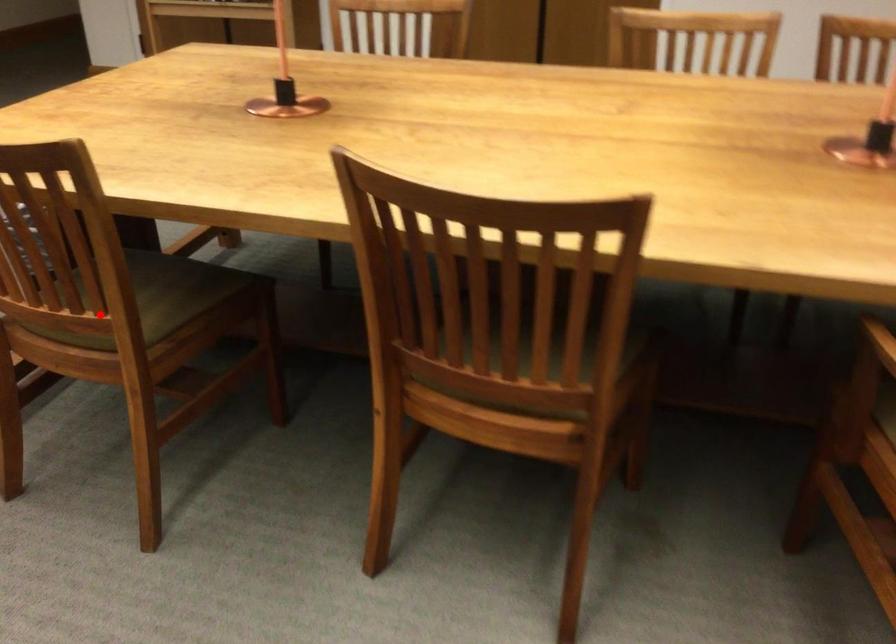
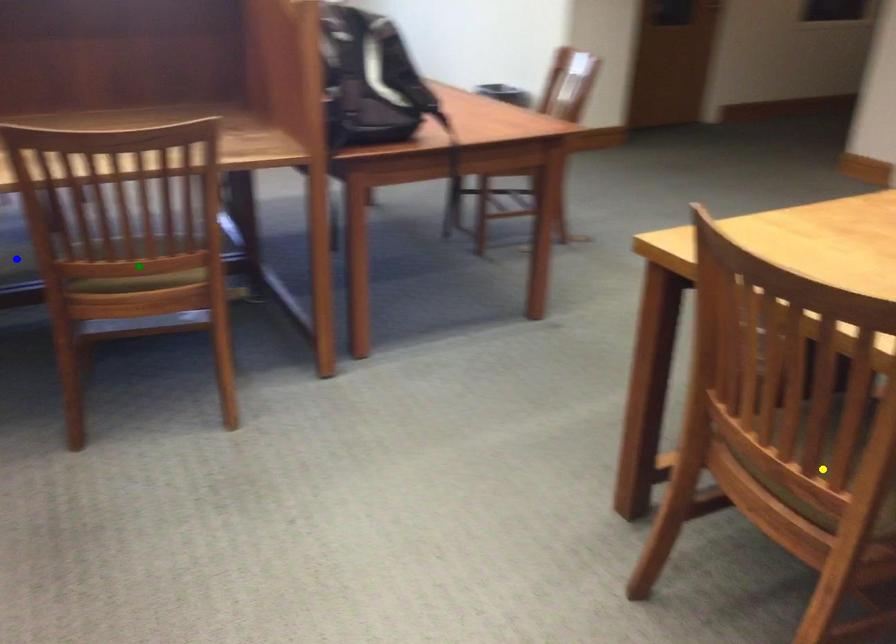
Question: I am providing you with two images of the same scene from different viewpoints. A red point is marked on the first image. You are given multiple points on the second image. Which point in image 2 represents the same 3d spot as the red point in image 1?

Choices:
 (A) yellow point
 (B) green point
 (C) blue point

Answer: (A)